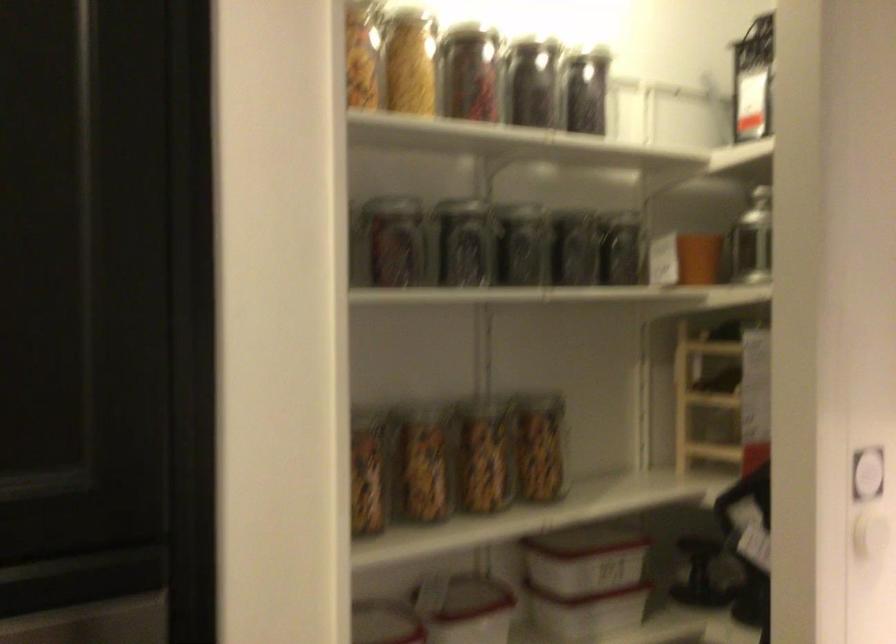
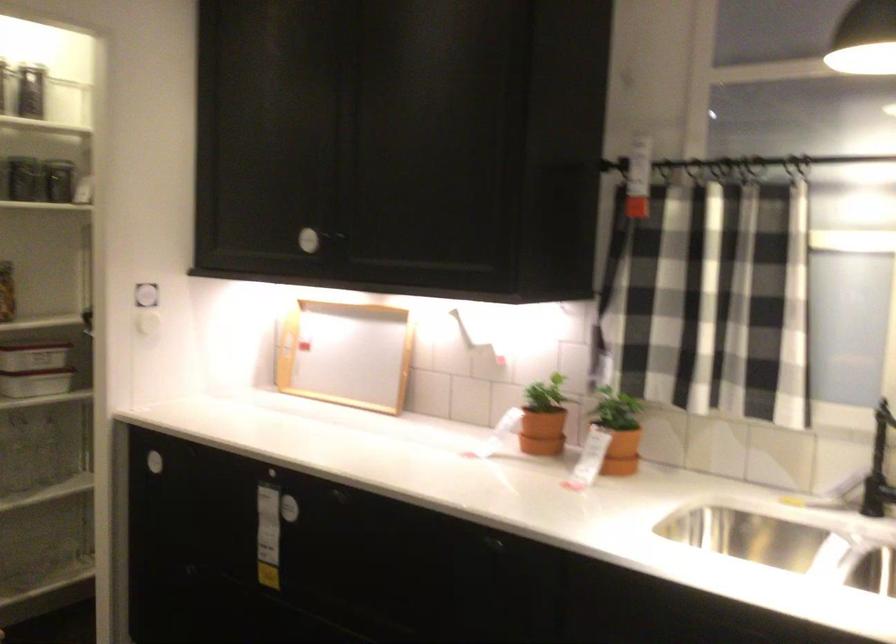
Find the pixel in the second image that matches pixel 599 96 in the first image.

(39, 91)